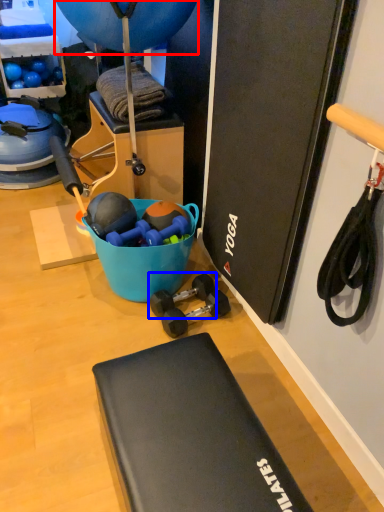
Question: Which point is further to the camera, balloon (highlighted by a red box) or dumbbell (highlighted by a blue box)?

Choices:
 (A) balloon
 (B) dumbbell

Answer: (B)